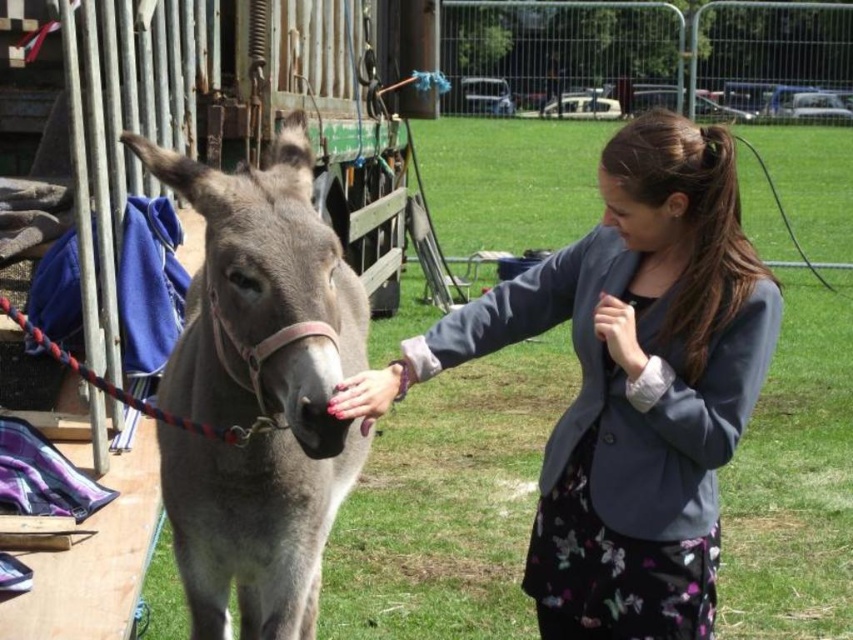
Between matte gray blazer at center and gray matte donkey at center, which one appears on the left side from the viewer's perspective?

gray matte donkey at center

Which of these two, matte gray blazer at center or gray matte donkey at center, stands shorter?

Standing shorter between the two is matte gray blazer at center.

This screenshot has width=853, height=640. Describe the element at coordinates (627, 385) in the screenshot. I see `matte gray blazer at center` at that location.

Find the location of a particular element. matte gray blazer at center is located at coordinates click(x=627, y=385).